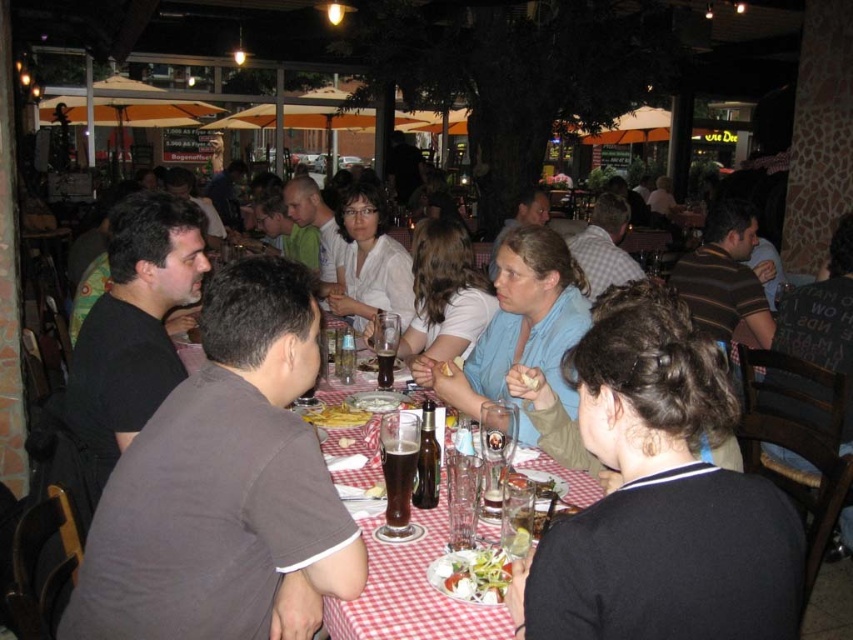
Who is positioned more to the right, matte white shirt at center or brown glass beer at table center?

Positioned to the right is matte white shirt at center.

Does matte white shirt at center have a lesser height compared to brown glass beer at table center?

No.

Image resolution: width=853 pixels, height=640 pixels. What are the coordinates of `matte white shirt at center` in the screenshot? It's located at (445, 294).

Is checkered fabric table at center to the right of yellow matte pasta at center from the viewer's perspective?

Correct, you'll find checkered fabric table at center to the right of yellow matte pasta at center.

Does point (323, 326) come farther from viewer compared to point (305, 410)?

Yes, it is.

The image size is (853, 640). Identify the location of checkered fabric table at center. coord(410,592).

Is dark brown shirt at left positioned before blue fabric shirt at center?

Yes, dark brown shirt at left is closer to the viewer.

Which is below, dark brown shirt at left or blue fabric shirt at center?

dark brown shirt at left is lower down.

Is point (294, 304) farther from camera compared to point (569, 387)?

No, (294, 304) is closer to viewer.

Identify the location of dark brown shirt at left. (224, 486).